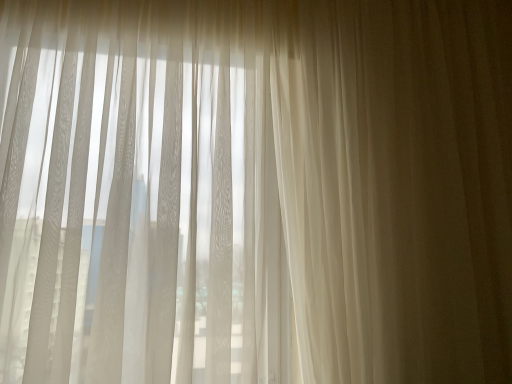
Question: Is sheer white curtain at right facing towards sheer white curtains at left?

Choices:
 (A) no
 (B) yes

Answer: (A)

Question: Can you confirm if sheer white curtain at right is wider than sheer white curtains at left?

Choices:
 (A) no
 (B) yes

Answer: (A)

Question: Considering the relative sizes of sheer white curtain at right and sheer white curtains at left in the image provided, is sheer white curtain at right shorter than sheer white curtains at left?

Choices:
 (A) no
 (B) yes

Answer: (A)

Question: Is sheer white curtain at right facing away from sheer white curtains at left?

Choices:
 (A) no
 (B) yes

Answer: (A)

Question: Does sheer white curtain at right have a greater height compared to sheer white curtains at left?

Choices:
 (A) yes
 (B) no

Answer: (A)

Question: From a real-world perspective, is sheer white curtain at right physically above sheer white curtains at left?

Choices:
 (A) no
 (B) yes

Answer: (B)

Question: Does sheer white curtains at left have a greater width compared to sheer white curtain at right?

Choices:
 (A) no
 (B) yes

Answer: (B)

Question: Is sheer white curtain at right located within sheer white curtains at left?

Choices:
 (A) yes
 (B) no

Answer: (B)

Question: From a real-world perspective, is sheer white curtains at left below sheer white curtain at right?

Choices:
 (A) yes
 (B) no

Answer: (A)

Question: Can you confirm if sheer white curtains at left is positioned to the left of sheer white curtain at right?

Choices:
 (A) yes
 (B) no

Answer: (A)

Question: Would you say sheer white curtains at left is outside sheer white curtain at right?

Choices:
 (A) yes
 (B) no

Answer: (A)

Question: Is sheer white curtains at left to the right of sheer white curtain at right from the viewer's perspective?

Choices:
 (A) yes
 (B) no

Answer: (B)

Question: Considering the positions of point (74, 274) and point (410, 236), is point (74, 274) closer or farther from the camera than point (410, 236)?

Choices:
 (A) farther
 (B) closer

Answer: (B)